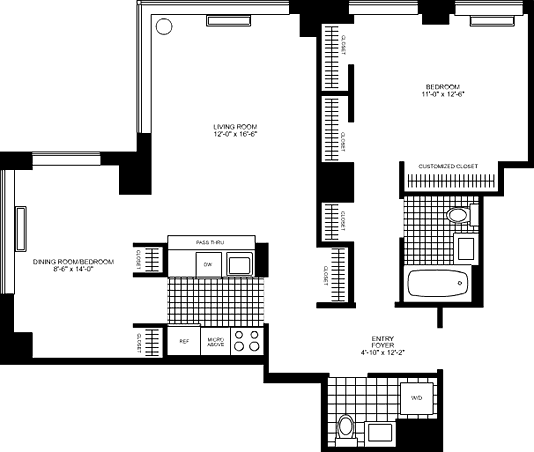
You are a GUI agent. You are given a task and a screenshot of the screen. Output one action in this format:
    pyautogui.click(x=<x>, y=<y>)
    Task: Click on the empty space in living room
    Image resolution: width=534 pixels, height=452 pixels.
    Given the screenshot: What is the action you would take?
    pyautogui.click(x=232, y=69)